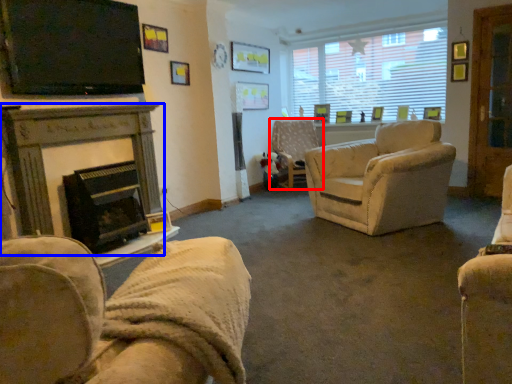
Question: Which object appears farthest to the camera in this image, chair (highlighted by a red box) or fireplace (highlighted by a blue box)?

Choices:
 (A) chair
 (B) fireplace

Answer: (A)